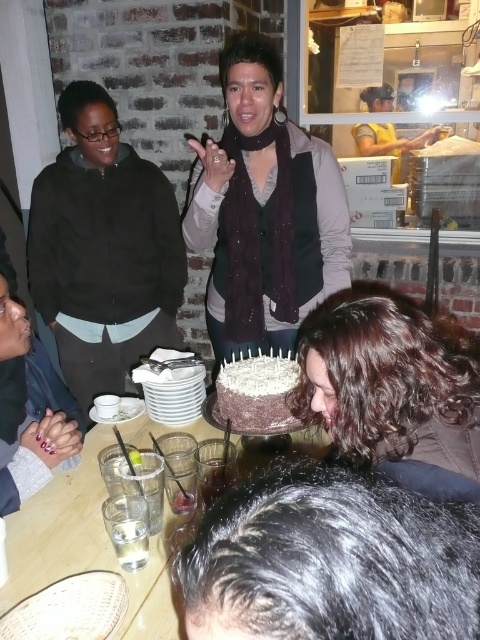
Consider the image. Is matte black scarf at center positioned in front of dark brown curly hair at lower center?

No, it is behind dark brown curly hair at lower center.

What do you see at coordinates (264, 211) in the screenshot?
I see `matte black scarf at center` at bounding box center [264, 211].

Who is more forward, (225, 90) or (468, 499)?

Point (468, 499) is in front.

Find the location of `matte black scarf at center`. matte black scarf at center is located at coordinates (264, 211).

Is matte black jacket at left positioned in front of dark brown curly hair at lower center?

No.

Is matte black jacket at left below dark brown curly hair at lower center?

No.

The height and width of the screenshot is (640, 480). I want to click on matte black jacket at left, so click(104, 250).

Locate an element on the screen. The width and height of the screenshot is (480, 640). matte black jacket at left is located at coordinates (104, 250).

Which is behind, point (29, 289) or point (35, 573)?

The point (29, 289) is more distant.

What do you see at coordinates (104, 250) in the screenshot? This screenshot has width=480, height=640. I see `matte black jacket at left` at bounding box center [104, 250].

Is point (62, 273) more distant than point (78, 515)?

Yes, point (62, 273) is behind point (78, 515).

Locate an element on the screen. matte black jacket at left is located at coordinates (104, 250).